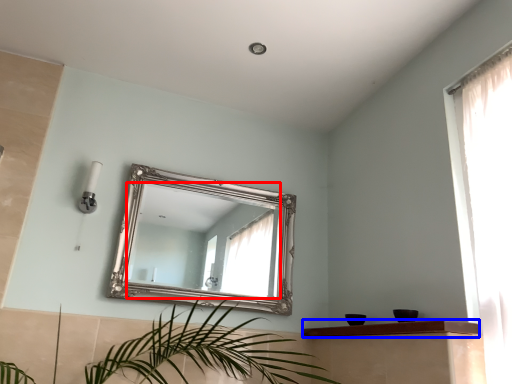
Question: Among these objects, which one is farthest to the camera, mirror (highlighted by a red box) or balustrade (highlighted by a blue box)?

Choices:
 (A) mirror
 (B) balustrade

Answer: (A)